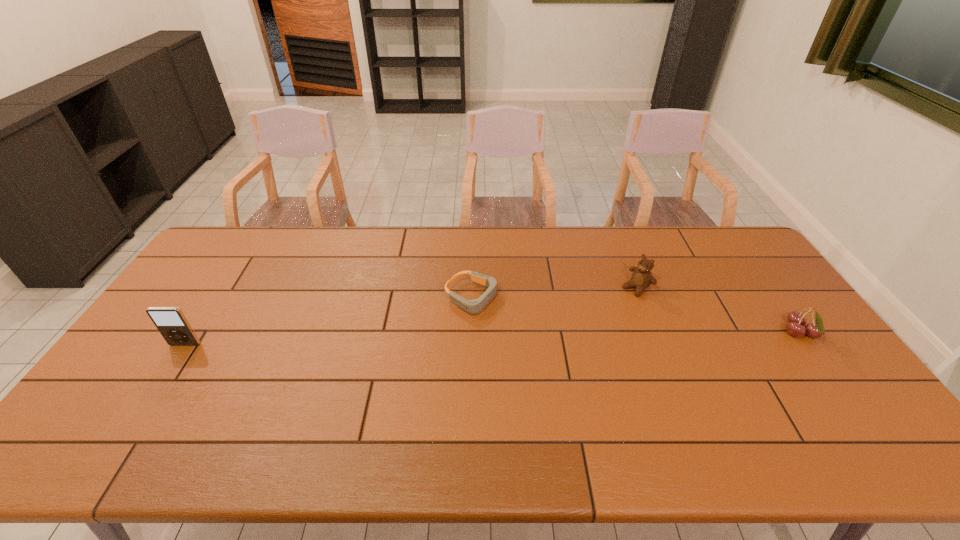
In order to click on vacant spot on the desktop that is between the iPod and the third tallest object and is positioned at the face of the second object from right to left in this screenshot , I will do `click(568, 338)`.

The image size is (960, 540). I want to click on vacant space on the desktop that is between the tallest object and the cherry and is positioned on the front and back of the goggles, so click(564, 338).